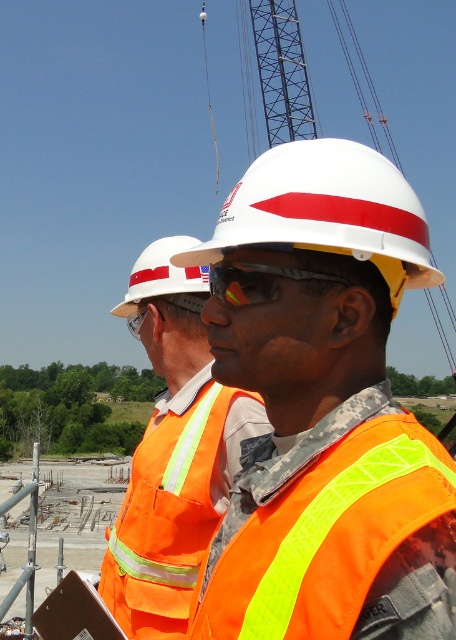
Between white hard hat at center and orange reflective safety vest at center, which one has more height?

Standing taller between the two is white hard hat at center.

Is point (359, 234) positioned before point (190, 452)?

Yes, it is in front of point (190, 452).

Identify the location of white hard hat at center. (327, 211).

Between point (363, 216) and point (241, 305), which one is positioned behind?

The point (241, 305) is more distant.

Is white hard hat at center thinner than clear plastic goggles at center?

Incorrect, white hard hat at center's width is not less than clear plastic goggles at center's.

This screenshot has width=456, height=640. What do you see at coordinates (327, 211) in the screenshot?
I see `white hard hat at center` at bounding box center [327, 211].

The width and height of the screenshot is (456, 640). I want to click on white hard hat at center, so click(327, 211).

Does point (387, 250) come in front of point (162, 252)?

Yes.

Locate an element on the screen. This screenshot has height=640, width=456. white hard hat at center is located at coordinates (327, 211).